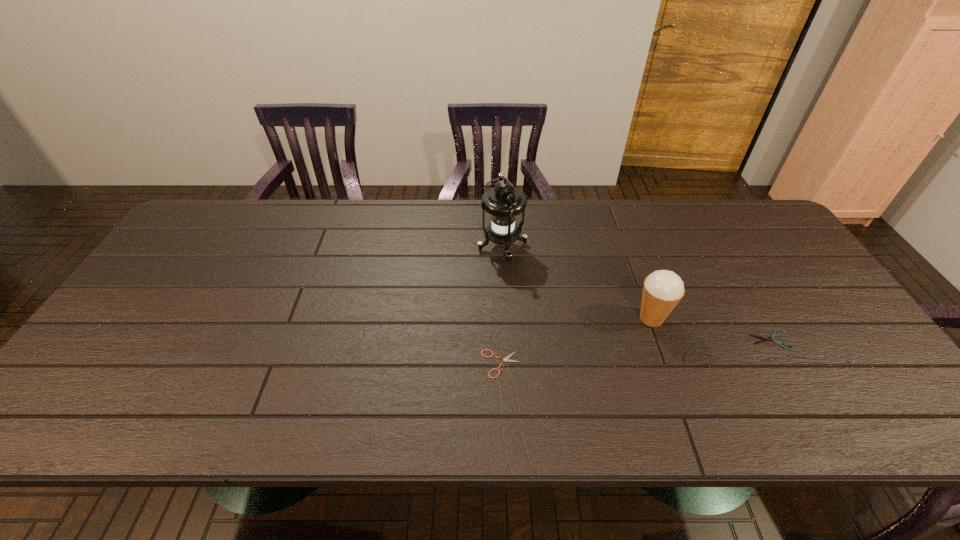
I want to click on vacant area that lies between the left shears and the second tallest object, so click(576, 341).

The image size is (960, 540). I want to click on vacant space that is in between the right shears and the left shears, so click(636, 352).

The height and width of the screenshot is (540, 960). What are the coordinates of `free area in between the farthest object and the icecream` in the screenshot? It's located at (577, 282).

This screenshot has height=540, width=960. What are the coordinates of `free space between the tallest object and the left shears` in the screenshot? It's located at (501, 305).

The image size is (960, 540). I want to click on unoccupied area between the icecream and the tallest object, so click(577, 282).

Identify the location of free space between the lantern and the third object from left to right. (577, 282).

The width and height of the screenshot is (960, 540). I want to click on blank region between the second tallest object and the left shears, so click(x=576, y=341).

Choose which object is the nearest neighbor to the rightmost object. Please provide its 2D coordinates. Your answer should be formatted as a tuple, i.e. [(x, y)], where the tuple contains the x and y coordinates of a point satisfying the conditions above.

[(663, 289)]

Where is `object that is the closest one to the icecream`? This screenshot has height=540, width=960. object that is the closest one to the icecream is located at coordinates (773, 335).

At what (x,y) coordinates should I click in order to perform the action: click on vacant space that satisfies the following two spatial constraints: 1. on the front side of the second tallest object; 2. on the right side of the right shears. Please return your answer as a coordinate pair (x, y). The height and width of the screenshot is (540, 960). Looking at the image, I should click on (659, 340).